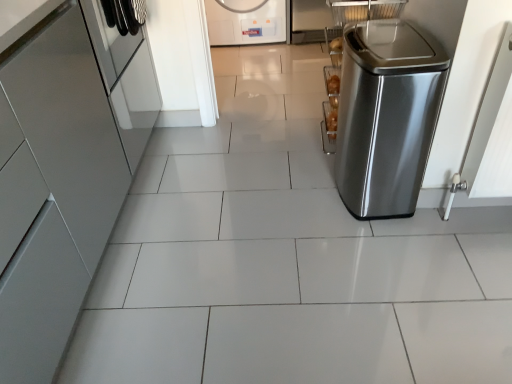
Question: From the image's perspective, is glossy metallic cabinet at left, the 2th home appliance when ordered from front to back, located beneath stainless steel trash can at right, which appears as the first home appliance when viewed from the right?

Choices:
 (A) no
 (B) yes

Answer: (A)

Question: From a real-world perspective, is glossy metallic cabinet at left, the 2th home appliance when ordered from front to back, over stainless steel trash can at right, arranged as the 3th home appliance when viewed from the left?

Choices:
 (A) yes
 (B) no

Answer: (A)

Question: From the image's perspective, is glossy metallic cabinet at left, positioned as the first home appliance in left-to-right order, on top of stainless steel trash can at right, the first home appliance positioned from the front?

Choices:
 (A) no
 (B) yes

Answer: (B)

Question: Considering the relative sizes of glossy metallic cabinet at left, which is counted as the 2th home appliance, starting from the back, and stainless steel trash can at right, which ranks as the third home appliance in back-to-front order, in the image provided, is glossy metallic cabinet at left, which is counted as the 2th home appliance, starting from the back, bigger than stainless steel trash can at right, which ranks as the third home appliance in back-to-front order,?

Choices:
 (A) no
 (B) yes

Answer: (B)

Question: Is glossy metallic cabinet at left, the 2th home appliance when ordered from front to back, positioned beyond the bounds of stainless steel trash can at right, arranged as the 3th home appliance when viewed from the left?

Choices:
 (A) yes
 (B) no

Answer: (A)

Question: Is glossy metallic cabinet at left, positioned as the first home appliance in left-to-right order, in front of or behind stainless steel trash can at right, the first home appliance positioned from the front, in the image?

Choices:
 (A) front
 (B) behind

Answer: (B)

Question: Is glossy metallic cabinet at left, the 2th home appliance when ordered from front to back, bigger or smaller than stainless steel trash can at right, which appears as the first home appliance when viewed from the right?

Choices:
 (A) small
 (B) big

Answer: (B)

Question: Would you say glossy metallic cabinet at left, marked as the 3th home appliance in a right-to-left arrangement, is to the left or to the right of stainless steel trash can at right, which ranks as the third home appliance in back-to-front order, in the picture?

Choices:
 (A) left
 (B) right

Answer: (A)

Question: Is glossy metallic cabinet at left, which is counted as the 2th home appliance, starting from the back, wider or thinner than stainless steel trash can at right, which ranks as the third home appliance in back-to-front order?

Choices:
 (A) wide
 (B) thin

Answer: (A)

Question: Considering the positions of white glossy washing machine at upper center, the 3th home appliance viewed from the front, and glossy metallic cabinet at left, marked as the 3th home appliance in a right-to-left arrangement, in the image, is white glossy washing machine at upper center, the 3th home appliance viewed from the front, taller or shorter than glossy metallic cabinet at left, marked as the 3th home appliance in a right-to-left arrangement,?

Choices:
 (A) tall
 (B) short

Answer: (B)

Question: Would you say white glossy washing machine at upper center, positioned as the 1th home appliance in back-to-front order, is inside or outside glossy metallic cabinet at left, positioned as the first home appliance in left-to-right order?

Choices:
 (A) inside
 (B) outside

Answer: (B)

Question: From a real-world perspective, is white glossy washing machine at upper center, arranged as the second home appliance when viewed from the right, positioned above or below glossy metallic cabinet at left, which is counted as the 2th home appliance, starting from the back?

Choices:
 (A) above
 (B) below

Answer: (B)

Question: Based on their sizes in the image, would you say white glossy washing machine at upper center, the 3th home appliance viewed from the front, is bigger or smaller than glossy metallic cabinet at left, which is counted as the 2th home appliance, starting from the back?

Choices:
 (A) small
 (B) big

Answer: (A)

Question: From a real-world perspective, relative to glossy metallic cabinet at left, positioned as the first home appliance in left-to-right order, is stainless steel trash can at right, the first home appliance positioned from the front, vertically above or below?

Choices:
 (A) below
 (B) above

Answer: (A)

Question: In terms of size, does stainless steel trash can at right, arranged as the 3th home appliance when viewed from the left, appear bigger or smaller than glossy metallic cabinet at left, positioned as the first home appliance in left-to-right order?

Choices:
 (A) small
 (B) big

Answer: (A)